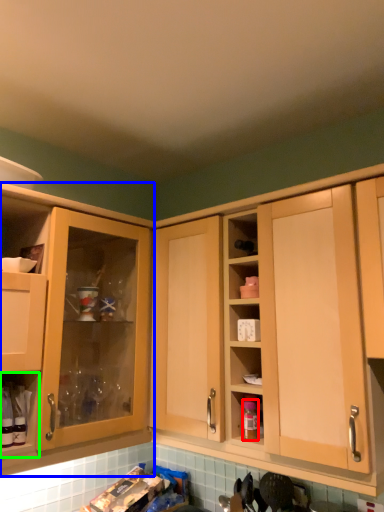
Question: Which object is positioned closest to bottle (highlighted by a red box)? Select from cabinetry (highlighted by a blue box) and cabinet (highlighted by a green box).

Choices:
 (A) cabinetry
 (B) cabinet

Answer: (A)